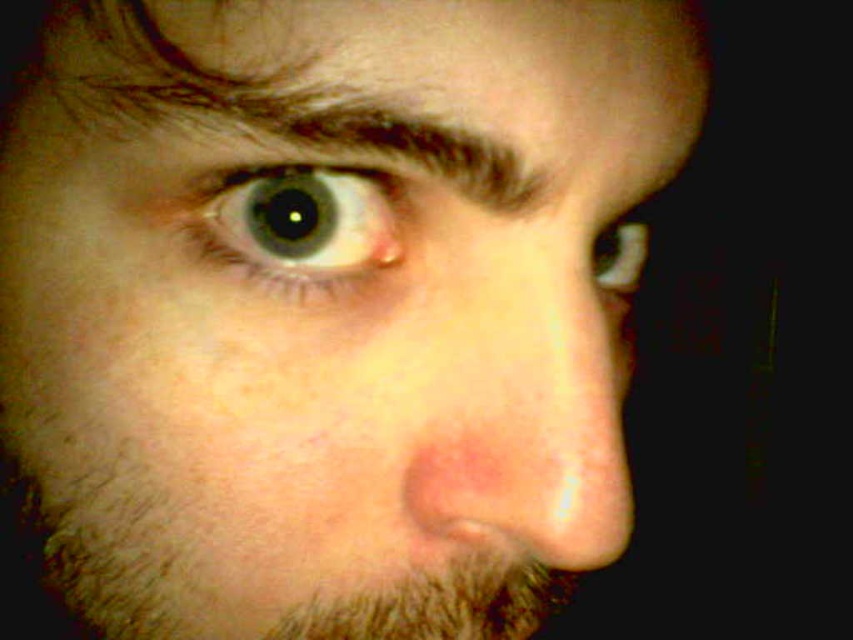
Question: Does brown fuzzy beard at lower left have a lesser width compared to light blue glossy eye at upper left?

Choices:
 (A) no
 (B) yes

Answer: (A)

Question: Does brown hair at upper left have a smaller size compared to light blue glossy eye at upper left?

Choices:
 (A) yes
 (B) no

Answer: (B)

Question: Estimate the real-world distances between objects in this image. Which object is closer to the light blue glossy eye at upper left?

Choices:
 (A) matte white eye at upper right
 (B) brown hair at upper left
 (C) brown fuzzy beard at lower left

Answer: (B)

Question: Which object is the farthest from the brown fuzzy beard at lower left?

Choices:
 (A) brown hair at upper left
 (B) light blue glossy eye at upper left

Answer: (A)

Question: Which of these objects is positioned farthest from the light blue glossy eye at upper left?

Choices:
 (A) brown hair at upper left
 (B) brown fuzzy beard at lower left

Answer: (B)

Question: Can you confirm if brown fuzzy beard at lower left is smaller than matte white eye at upper right?

Choices:
 (A) yes
 (B) no

Answer: (B)